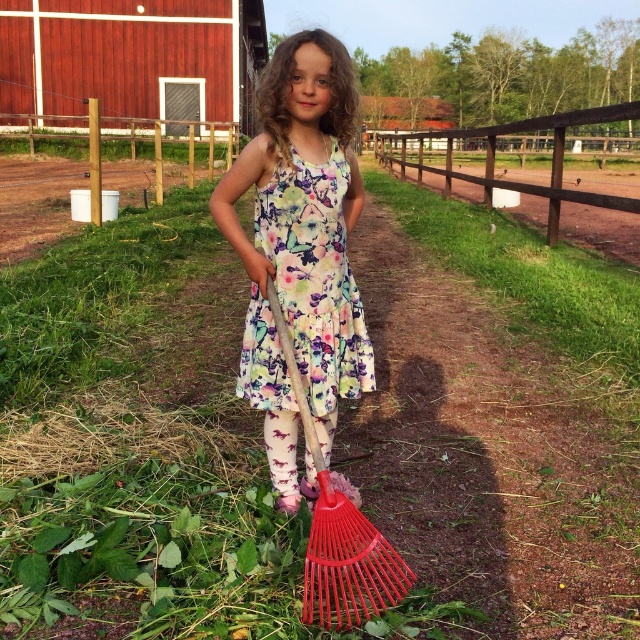
Which is above, floral fabric dress at center or brown wooden fence at upper center?

Positioned higher is brown wooden fence at upper center.

Between floral fabric dress at center and brown wooden fence at upper center, which one has more height?

brown wooden fence at upper center is taller.

Is point (330, 298) closer to viewer compared to point (486, 147)?

Yes, it is in front of point (486, 147).

Where is `floral fabric dress at center`? floral fabric dress at center is located at coordinates (300, 250).

Is point (365, 390) more distant than point (445, 188)?

That is False.

Does point (332, 173) come in front of point (416, 138)?

Yes.

Identify the location of floral cotton dress at center. (316, 275).

Is floral cotton dress at center above wooden handle rake at center?

Yes, floral cotton dress at center is above wooden handle rake at center.

Between floral cotton dress at center and wooden handle rake at center, which one appears on the left side from the viewer's perspective?

From the viewer's perspective, floral cotton dress at center appears more on the left side.

Describe the element at coordinates (316, 275) in the screenshot. This screenshot has height=640, width=640. I see `floral cotton dress at center` at that location.

The height and width of the screenshot is (640, 640). Find the location of `floral cotton dress at center`. floral cotton dress at center is located at coordinates (316, 275).